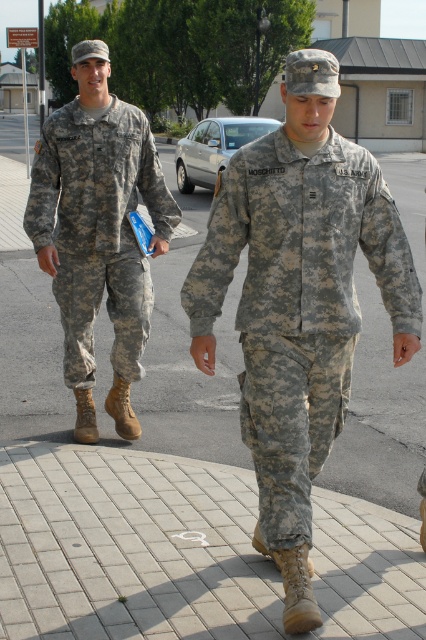
What do you see at coordinates (204, 353) in the screenshot?
I see `light skin tone flesh at center` at bounding box center [204, 353].

Who is more forward, (201, 346) or (412, 348)?

Positioned in front is point (412, 348).

Identify the location of light skin tone flesh at center. The width and height of the screenshot is (426, 640). (204, 353).

Can you confirm if camouflage fabric uniform at left is wider than matte skin hand at center?

Indeed, camouflage fabric uniform at left has a greater width compared to matte skin hand at center.

Between point (32, 237) and point (403, 355), which one is positioned behind?

The point (32, 237) is more distant.

Find the location of a particular element. The width and height of the screenshot is (426, 640). camouflage fabric uniform at left is located at coordinates (98, 228).

Between camouflage fabric uniform at left and light skin tone flesh at center, which one appears on the left side from the viewer's perspective?

Answer: camouflage fabric uniform at left is more to the left.

What do you see at coordinates (98, 228) in the screenshot? This screenshot has width=426, height=640. I see `camouflage fabric uniform at left` at bounding box center [98, 228].

What are the coordinates of `camouflage fabric uniform at left` in the screenshot? It's located at pos(98,228).